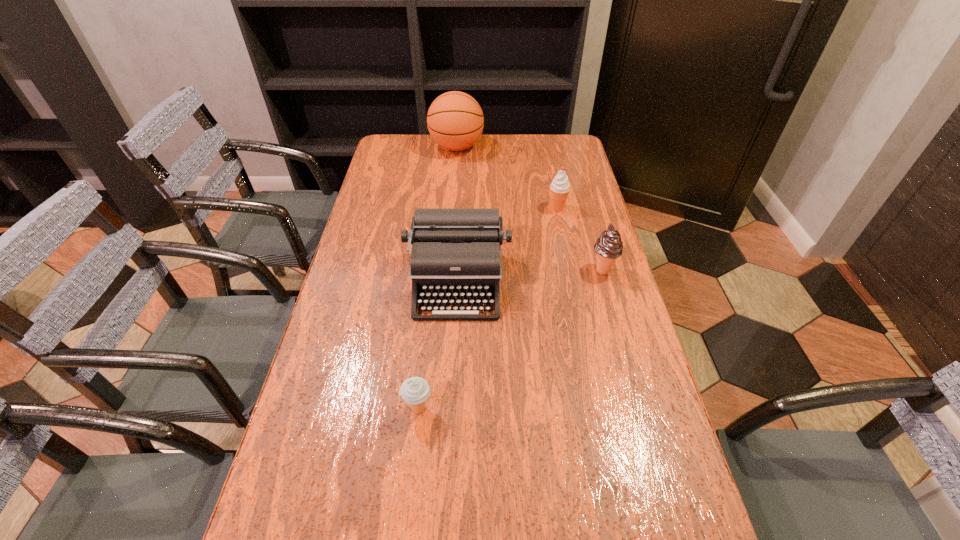
Identify the location of free space between the farthest icecream and the rightmost object. (580, 239).

Locate an element on the screen. vacant area between the second farthest object and the rightmost icecream is located at coordinates (580, 239).

The height and width of the screenshot is (540, 960). In order to click on free space between the shortest object and the typewriter in this screenshot , I will do `click(438, 346)`.

Locate which object is the third closest to the leftmost icecream. Please provide its 2D coordinates. Your answer should be formatted as a tuple, i.e. [(x, y)], where the tuple contains the x and y coordinates of a point satisfying the conditions above.

[(559, 188)]

The height and width of the screenshot is (540, 960). What are the coordinates of `object that is the second closest to the basketball` in the screenshot? It's located at (455, 252).

Identify which icecream is located as the second nearest to the rightmost object. Please provide its 2D coordinates. Your answer should be formatted as a tuple, i.e. [(x, y)], where the tuple contains the x and y coordinates of a point satisfying the conditions above.

[(415, 391)]

Point out which icecream is positioned as the second nearest to the typewriter. Please provide its 2D coordinates. Your answer should be formatted as a tuple, i.e. [(x, y)], where the tuple contains the x and y coordinates of a point satisfying the conditions above.

[(608, 247)]

I want to click on vacant point that satisfies the following two spatial constraints: 1. on the back side of the basketball; 2. on the left side of the shortest object, so click(x=446, y=147).